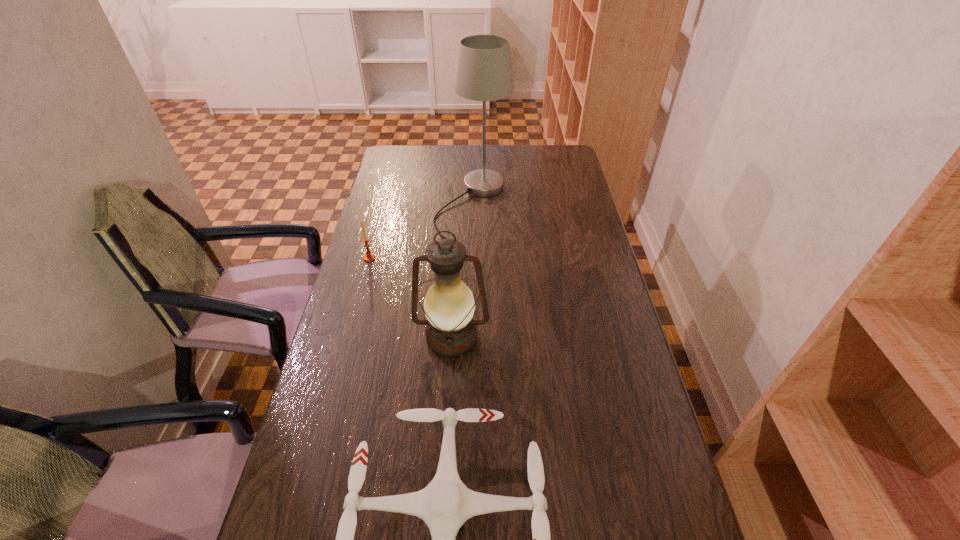
Image resolution: width=960 pixels, height=540 pixels. What are the coordinates of `table lamp` in the screenshot? It's located at pyautogui.click(x=484, y=72).

Where is `the farthest object`? the farthest object is located at coordinates (484, 72).

Locate an element on the screen. the third shortest object is located at coordinates (449, 305).

Locate an element on the screen. The width and height of the screenshot is (960, 540). oil lamp is located at coordinates (449, 305).

I want to click on the third tallest object, so click(x=369, y=257).

At what (x,y) coordinates should I click in order to perform the action: click on candle_holder. Please return your answer as a coordinate pair (x, y). This screenshot has height=540, width=960. Looking at the image, I should click on (369, 257).

Image resolution: width=960 pixels, height=540 pixels. Find the location of `vacant space situated on the front of the farthest object`. vacant space situated on the front of the farthest object is located at coordinates (470, 307).

In order to click on vacant space situated 0.060m on the front of the second tallest object in this screenshot , I will do `click(449, 382)`.

Where is `vacant region located 0.290m on the front of the third nearest object`? The height and width of the screenshot is (540, 960). vacant region located 0.290m on the front of the third nearest object is located at coordinates (350, 327).

Find the location of a particular element. object that is at the left edge is located at coordinates (369, 257).